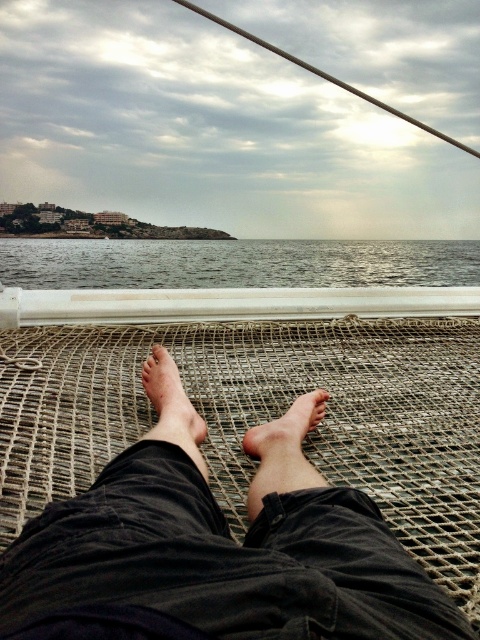
Is the position of gray water at center more distant than that of dry skin at center?

Yes, it is behind dry skin at center.

At what (x,y) coordinates should I click in order to perform the action: click on gray water at center. Please return your answer as a coordinate pair (x, y). The height and width of the screenshot is (640, 480). Looking at the image, I should click on (236, 262).

In the scene shown: How distant is dark fabric legs at center from brown rough skin at center?

dark fabric legs at center is 16.57 inches away from brown rough skin at center.

Can you confirm if dark fabric legs at center is shorter than brown rough skin at center?

No.

The height and width of the screenshot is (640, 480). I want to click on dark fabric legs at center, so click(x=216, y=561).

Who is taller, dark fabric legs at center or gray water at center?

Standing taller between the two is gray water at center.

Locate an element on the screen. dark fabric legs at center is located at coordinates (216, 561).

Does point (202, 536) come closer to viewer compared to point (303, 262)?

Yes, point (202, 536) is in front of point (303, 262).

Locate an element on the screen. The image size is (480, 640). dark fabric legs at center is located at coordinates (216, 561).